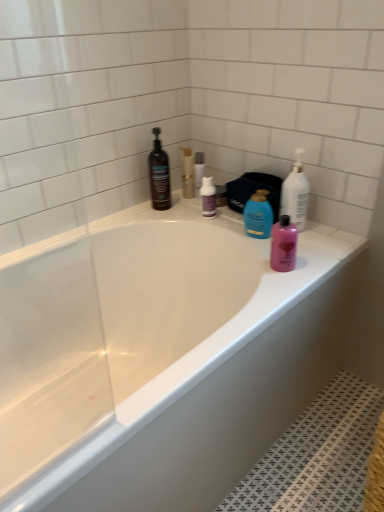
Image resolution: width=384 pixels, height=512 pixels. Identify the location of vacant area that lies in front of blue glossy bottle at upper center, the second cleaning product when ordered from right to left. (294, 260).